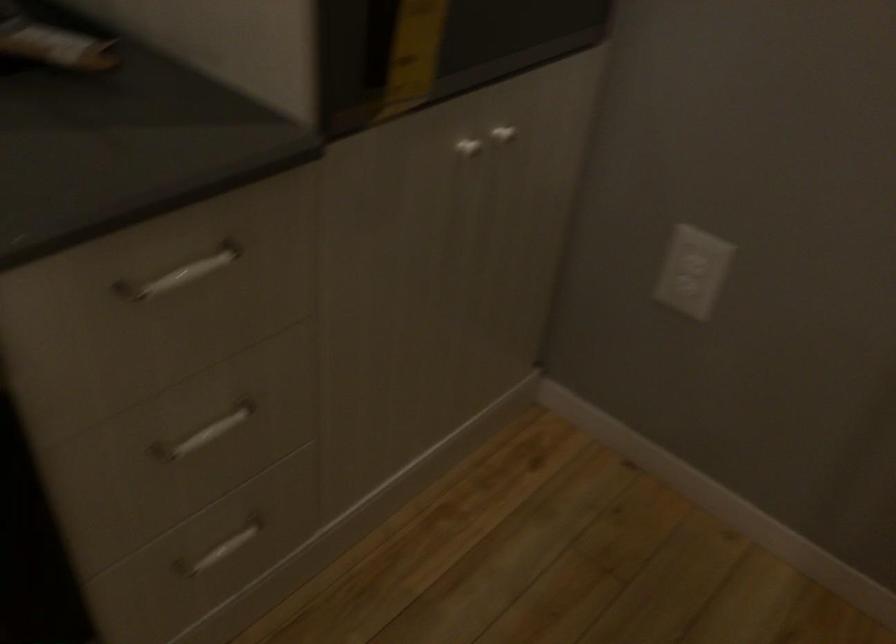
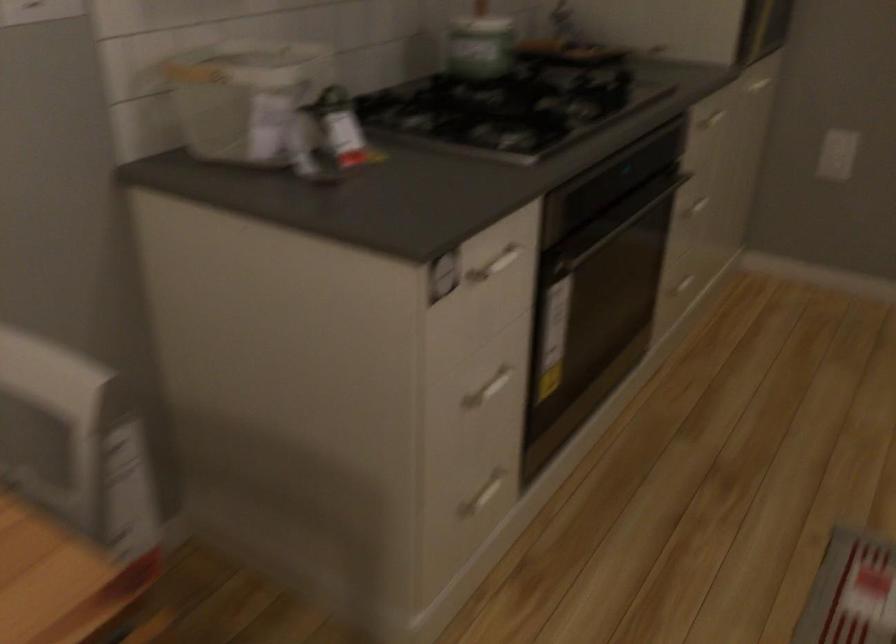
The point at (208, 272) is marked in the first image. Where is the corresponding point in the second image?

(713, 118)